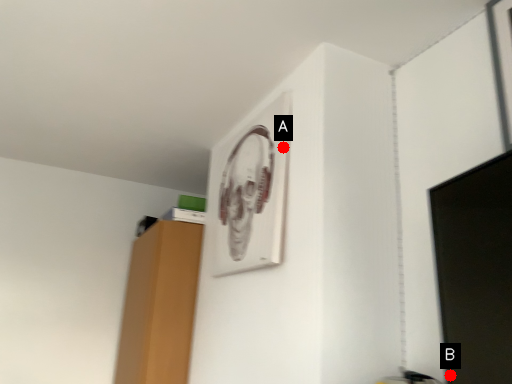
Question: Two points are circled on the image, labeled by A and B beside each circle. Which point is closer to the camera?

Choices:
 (A) A is closer
 (B) B is closer

Answer: (B)